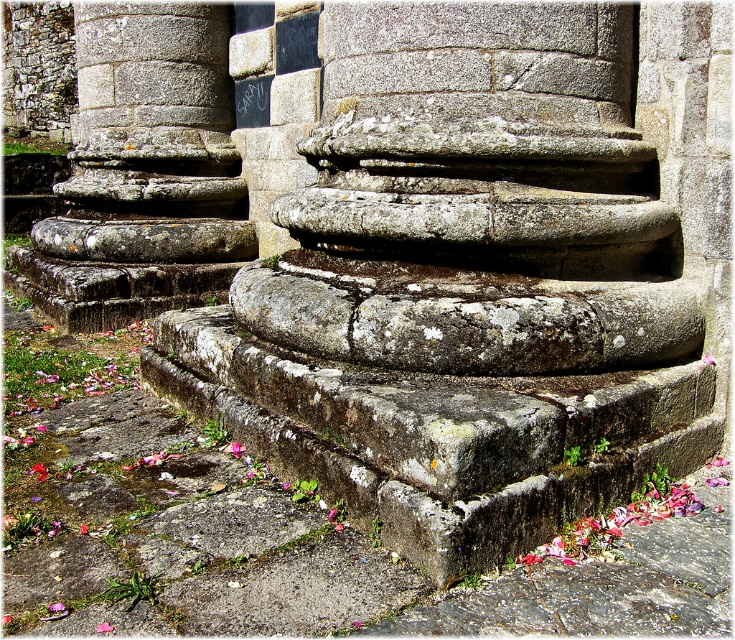
You are standing at the base of the ancient stone columns and want to reach the paved area with pink petals in the foreground. Which direction should you move relative to the gray stone stairs at center?

You should move towards the gray stone stairs at center since they are located at point (462, 289), which is in the center of the image, leading towards the paved area with pink petals in the foreground.

Consider the image. You are standing at the base of the ancient stone columns and see the gray stone stairs at center and the granite steps at center. Which one is located to the right?

The gray stone stairs at center is positioned on the right side of granite steps at center, so the gray stone stairs at center is located to the right.